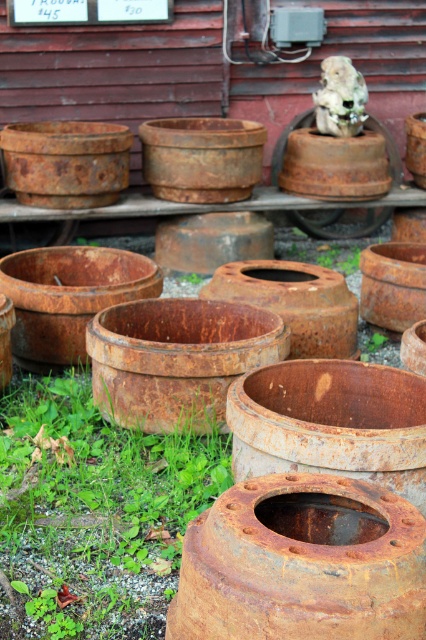
Question: Can you confirm if green grass at lower left is thinner than rusty metal tire at center?

Choices:
 (A) no
 (B) yes

Answer: (A)

Question: Is green grass at lower left further to the viewer compared to rusty metal tire at center?

Choices:
 (A) no
 (B) yes

Answer: (A)

Question: Can you confirm if green grass at lower left is positioned to the left of rusty metal tire at center?

Choices:
 (A) yes
 (B) no

Answer: (A)

Question: Among these points, which one is nearest to the camera?

Choices:
 (A) (137, 557)
 (B) (285, 147)

Answer: (A)

Question: Which object appears closest to the camera in this image?

Choices:
 (A) green grass at lower left
 (B) rusty metal tire at center

Answer: (A)

Question: Which point appears farthest from the camera in this image?

Choices:
 (A) (43, 538)
 (B) (377, 220)

Answer: (B)